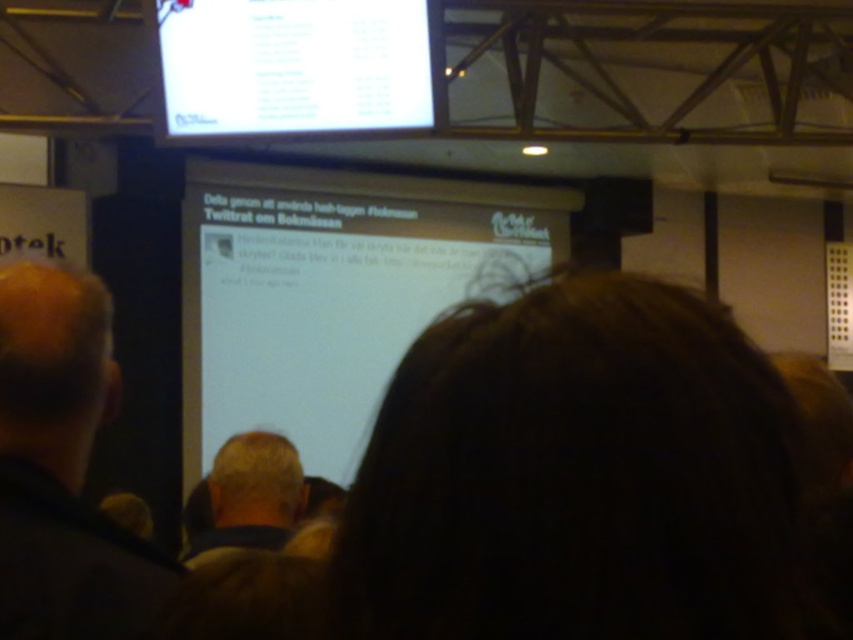
You are an event photographer trying to capture a clear shot of the presentation screen. You notice two attendees with dark brown hair at center and blonde hair at center. Based on their positions, which attendee is blocking your view of the screen more?

The blonde hair at center is blocking the view more because the dark brown hair at center is positioned to the right of it, meaning the blonde hair is closer to the center where the photographer is likely positioned.

You are an attendee at the conference and want to take a photo of both the point at location (x=268, y=355) and the point at location (x=247, y=90) on the screen. However, you notice that one of them is partially blocked by the projection screen. Which point is more likely to be visible in your photo?

Point at location (x=247, y=90) is more likely to be visible because point at location (x=268, y=355) is behind it.

You are an event organizer checking the setup for a presentation. You notice two screens in the image. Which one is bigger between the white matte screen at center and the white glossy screen at upper center?

The white matte screen at center is larger in size than the white glossy screen at upper center.